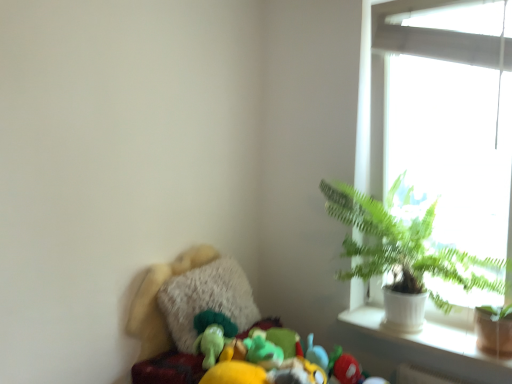
Where is `blank space above white ceramic pot at upper right (from a real-world perspective)`? blank space above white ceramic pot at upper right (from a real-world perspective) is located at coordinates (416, 332).